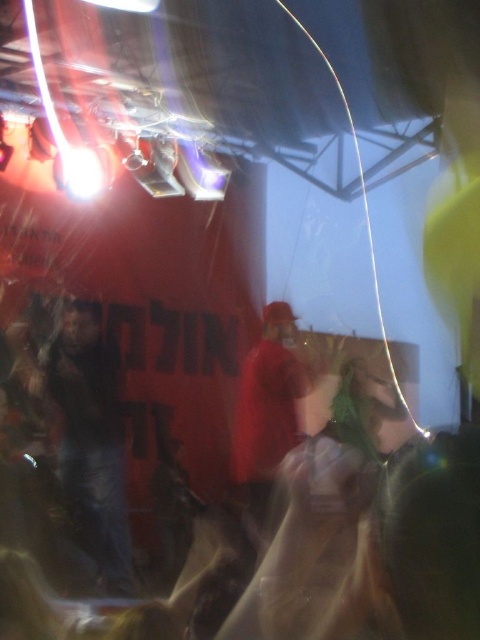
You are a photographer trying to capture a clear shot of the dark blue jeans at center and the red fabric cap at center. Based on the scene description, which object is wider in the image?

The dark blue jeans at center might be wider than the red fabric cap at center.

You are at an event and want to take a photo of the red fabric cap at center without including the dark blue jeans at center. Can you move in a direction to achieve this?

The dark blue jeans at center is closer to the viewer than the red fabric cap at center. To avoid including the dark blue jeans at center in the photo, you should move sideways or adjust your angle so that the red fabric cap at center is framed without the dark blue jeans at center blocking the view.

You are standing in the middle of the concert hall and see two points marked in the image. The first point is at coordinates point (70, 481) and the second is at point (249, 524). Which point is closer to you?

Point (70, 481) is closer to the viewer than point (249, 524).